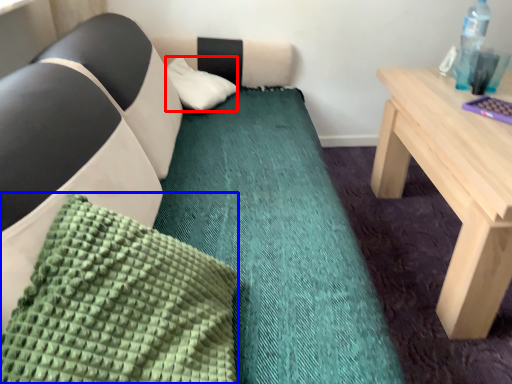
Question: Which object appears closest to the camera in this image, pillow (highlighted by a red box) or pillow (highlighted by a blue box)?

Choices:
 (A) pillow
 (B) pillow

Answer: (B)